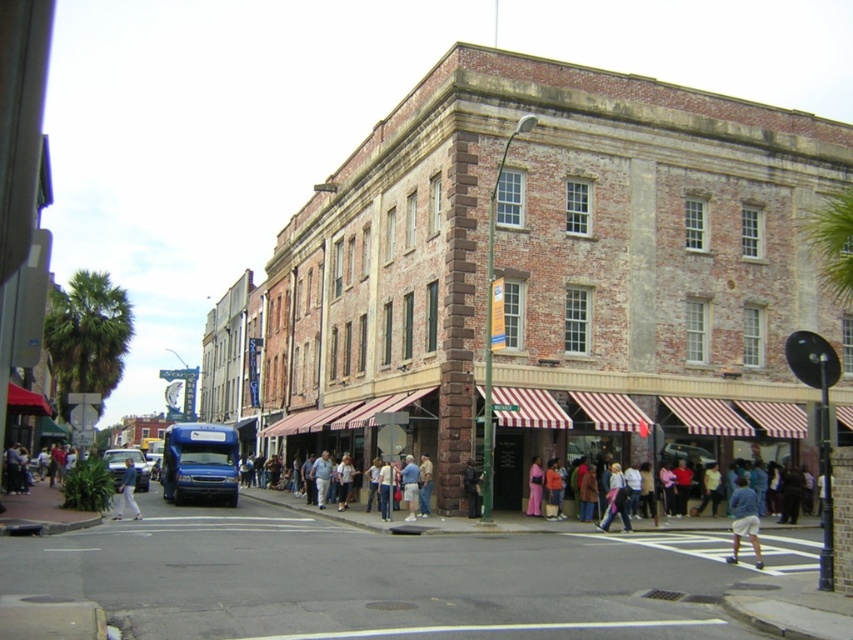
You are a photographer standing in the middle of the street looking at the light blue jeans at lower center and the denim jacket at lower center. Which one is positioned more to the right side?

The light blue jeans at lower center is positioned more to the right side than the denim jacket at lower center.

You are a photographer setting up a tripod in this urban scene. You need to position your tripod so that it doesn not block either the light blue jeans at lower left or the pink satin dress at center. Given that the tripod requires a minimum of 1 meter of space around it to avoid obstruction, can you place it safely between these two objects?

The light blue jeans at lower left might be wider than the pink satin dress at center, but without knowing the exact width of the jeans, it is uncertain if the 1 meter clearance can be maintained. The photographer should measure the distance between the two objects to ensure there is sufficient space for the tripod.